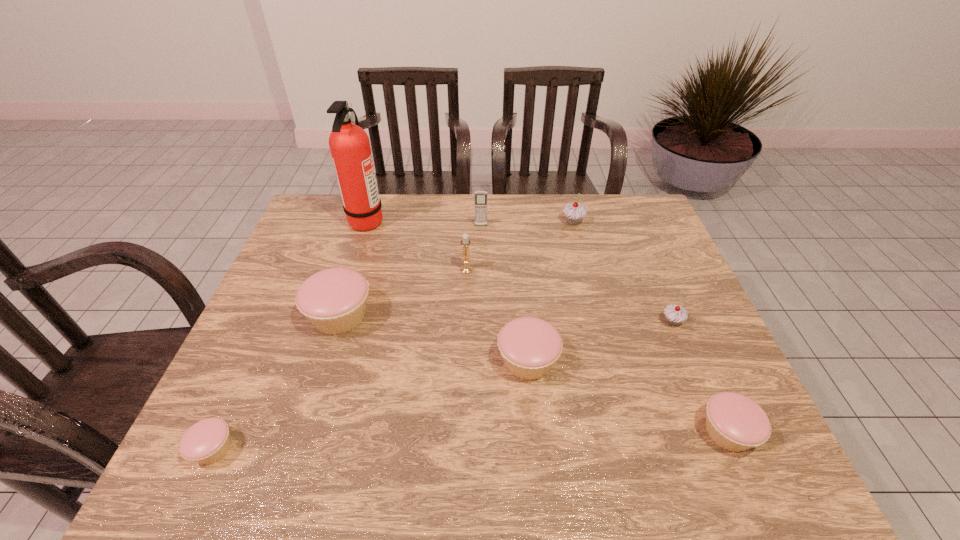
Image resolution: width=960 pixels, height=540 pixels. I want to click on fire extinguisher that is at the left edge, so click(x=349, y=144).

Identify the location of object present at the far left corner. The width and height of the screenshot is (960, 540). (349, 144).

Where is `object located in the near left corner section of the desktop`? The image size is (960, 540). object located in the near left corner section of the desktop is located at coordinates (207, 441).

This screenshot has height=540, width=960. Find the location of `object that is at the near right corner`. object that is at the near right corner is located at coordinates (734, 422).

In the image, there is a desktop. Identify the location of free space at the far edge. This screenshot has height=540, width=960. (428, 225).

The width and height of the screenshot is (960, 540). In order to click on free space at the near edge of the desktop in this screenshot , I will do `click(346, 453)`.

Locate an element on the screen. free region at the left edge is located at coordinates (275, 291).

At what (x,y) coordinates should I click in order to perform the action: click on free space at the right edge of the desktop. Please return your answer as a coordinate pair (x, y). This screenshot has height=540, width=960. Looking at the image, I should click on (714, 384).

Locate an element on the screen. vacant space at the near left corner of the desktop is located at coordinates (246, 442).

The image size is (960, 540). Find the location of `vacant space at the far right corner of the desktop`. vacant space at the far right corner of the desktop is located at coordinates (613, 230).